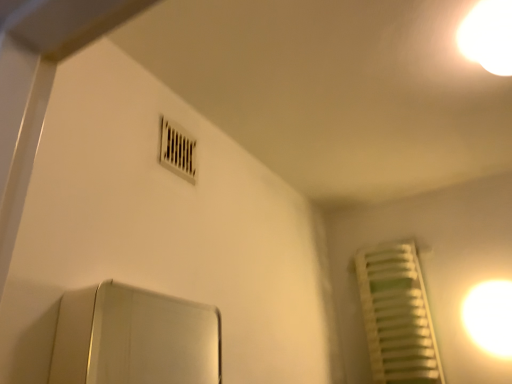
Question: Is white matte radiator at right inside or outside of white glossy light at upper right, arranged as the 1th light when viewed from the back?

Choices:
 (A) inside
 (B) outside

Answer: (B)

Question: Relative to white glossy light at upper right, the 2th light when ordered from top to bottom, is white matte radiator at right in front or behind?

Choices:
 (A) behind
 (B) front

Answer: (A)

Question: Which is farther from the white plastic air conditioning at upper center?

Choices:
 (A) white matte radiator at right
 (B) white glossy light bulb at upper right, arranged as the first light when viewed from the front
 (C) white glossy light at upper right, the second light from the front

Answer: (C)

Question: Which is nearer to the white matte radiator at right?

Choices:
 (A) white glossy light at upper right, which is the first light in bottom-to-top order
 (B) white glossy light bulb at upper right, the 2th light from the right
 (C) white plastic air conditioning at upper center

Answer: (A)